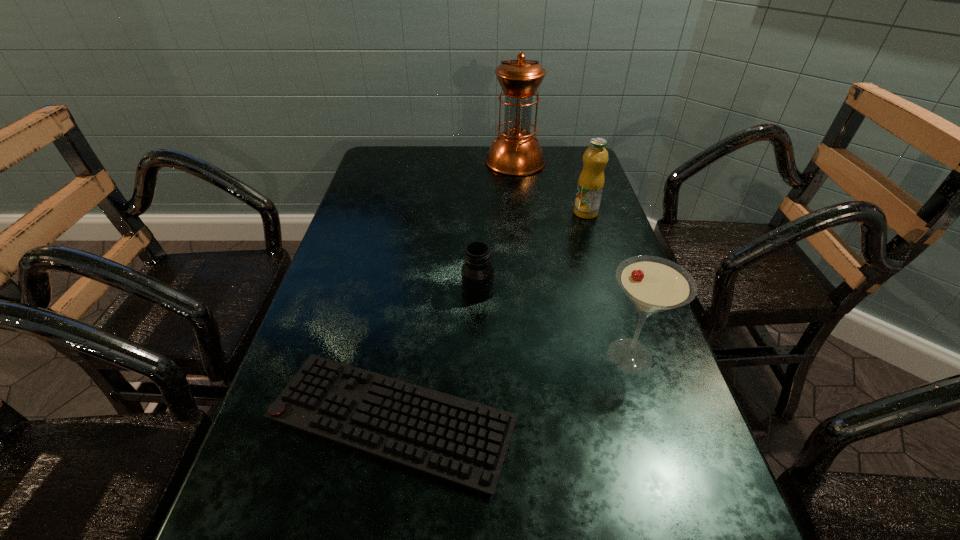
Where is `the farthest object`? This screenshot has height=540, width=960. the farthest object is located at coordinates (516, 151).

Locate an element on the screen. The image size is (960, 540). oil lamp is located at coordinates (516, 151).

Locate an element on the screen. Image resolution: width=960 pixels, height=540 pixels. fruit juice is located at coordinates (591, 181).

Image resolution: width=960 pixels, height=540 pixels. What are the coordinates of `martini` in the screenshot? It's located at (653, 284).

Locate an element on the screen. This screenshot has height=540, width=960. the third farthest object is located at coordinates (477, 273).

Identify the location of the fourth tallest object. The height and width of the screenshot is (540, 960). (477, 273).

Find the location of `the shortest object`. the shortest object is located at coordinates (464, 442).

The width and height of the screenshot is (960, 540). I want to click on vacant space located on the front of the tallest object, so click(x=523, y=222).

This screenshot has height=540, width=960. Identify the location of vacant space situated on the front label of the fourth nearest object. (612, 298).

The height and width of the screenshot is (540, 960). What are the coordinates of `vacant space located 0.130m on the left of the martini` in the screenshot? It's located at (531, 355).